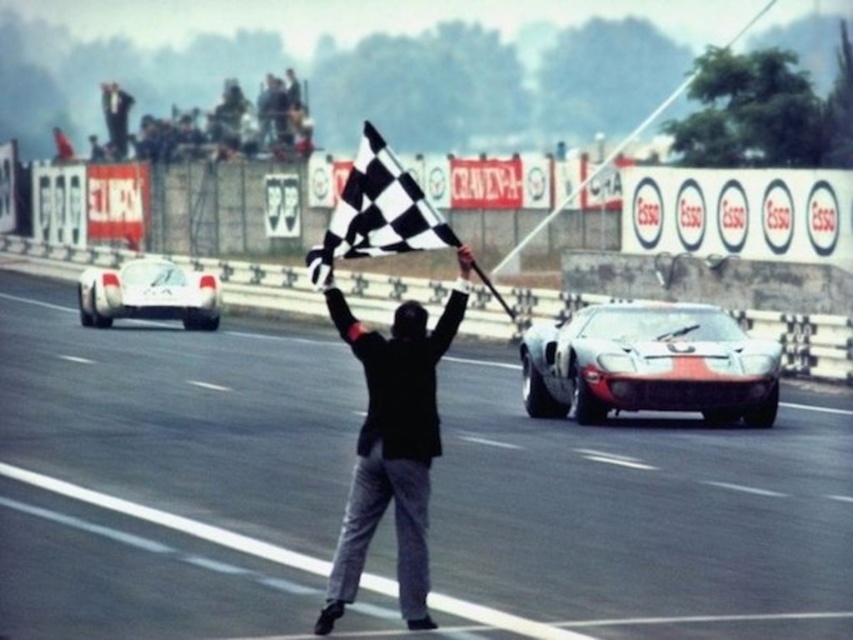
You are a race official standing at the side of the track. You need to place a new lane marker between the smooth asphalt road at center and the silver metallic sports car at center. Based on their positions, which object should the lane marker be placed closer to?

The lane marker should be placed closer to the smooth asphalt road at center since it is to the left of the silver metallic sports car at center.

You are a race car driver approaching the finish line. You notice two points on the track ahead. The first is at point (354, 339) and the second is at point (352, 180). Which point should you aim for first to reach the finish line?

You should aim for point (354, 339) first because it is in front of point (352, 180) along the track.